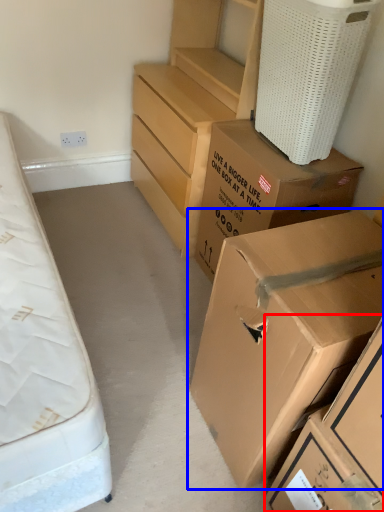
Question: Which object is further to the camera taking this photo, box (highlighted by a red box) or box (highlighted by a blue box)?

Choices:
 (A) box
 (B) box

Answer: (A)